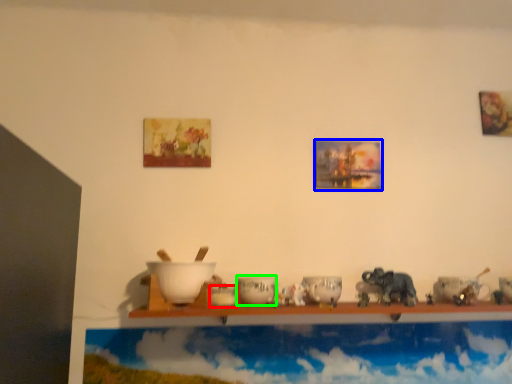
Question: Which is farther away from tableware (highlighted by a red box)? picture frame (highlighted by a blue box) or tableware (highlighted by a green box)?

Choices:
 (A) picture frame
 (B) tableware

Answer: (A)